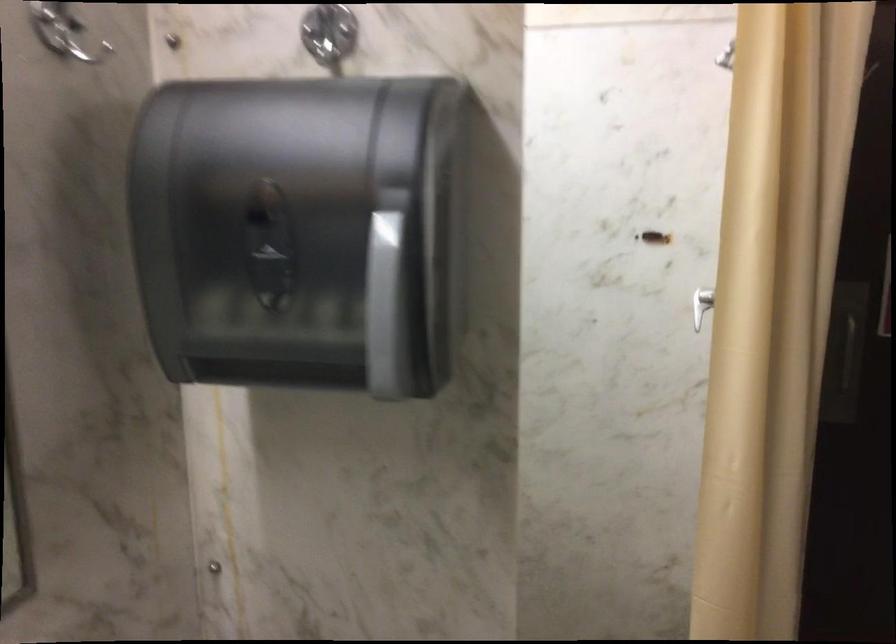
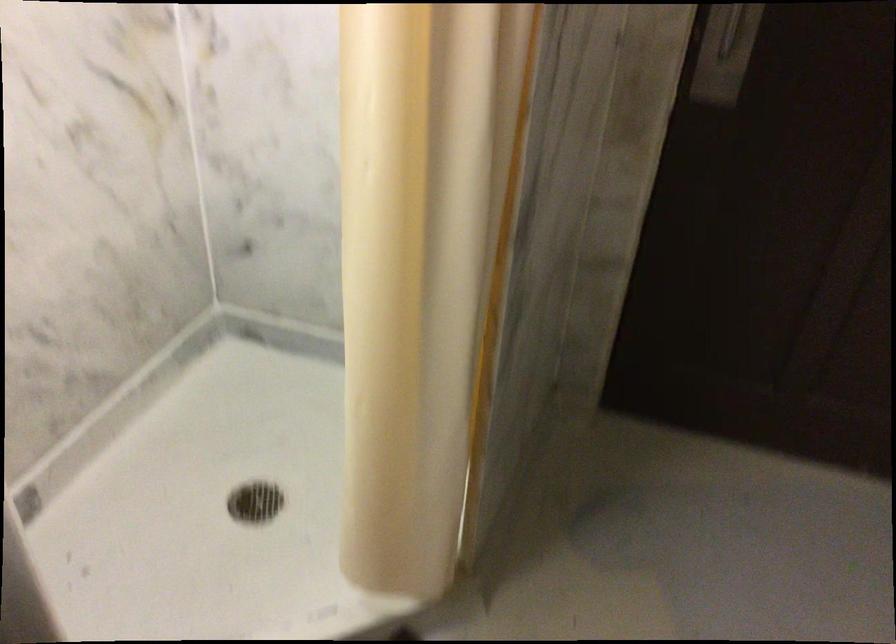
The images are taken continuously from a first-person perspective. In which direction are you moving?

The cameraman walked toward right, forward.